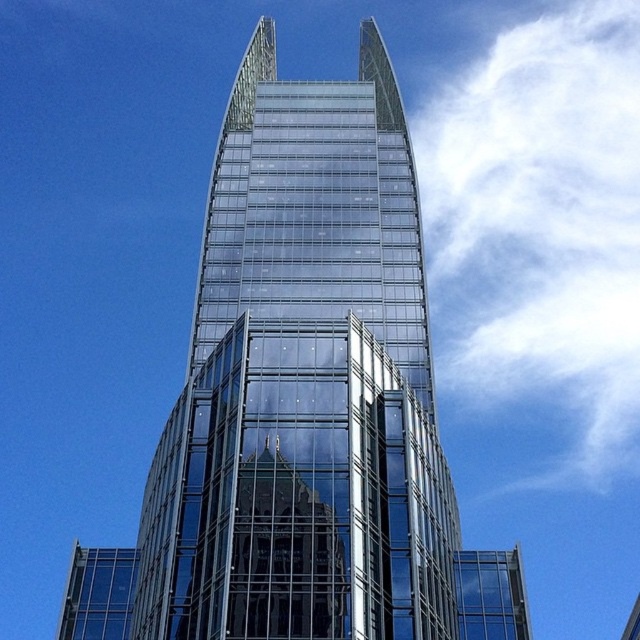
Which is more to the left, transparent glass tower at center or white fluffy cloud at upper right?

From the viewer's perspective, transparent glass tower at center appears more on the left side.

Is transparent glass tower at center closer to the viewer compared to white fluffy cloud at upper right?

Yes, transparent glass tower at center is closer to the viewer.

Is point (406, 378) farther from viewer compared to point (584, 468)?

No, (406, 378) is closer to viewer.

Identify the location of transparent glass tower at center. The height and width of the screenshot is (640, 640). (304, 384).